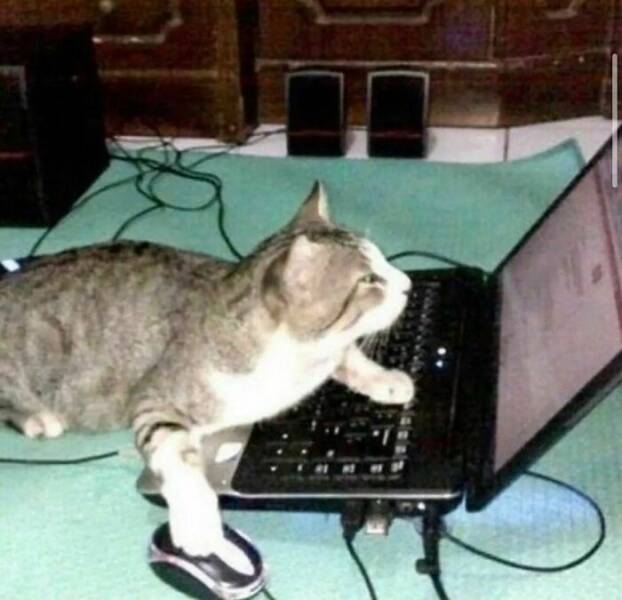
Where is `speakers`? speakers is located at coordinates (330, 137), (384, 115).